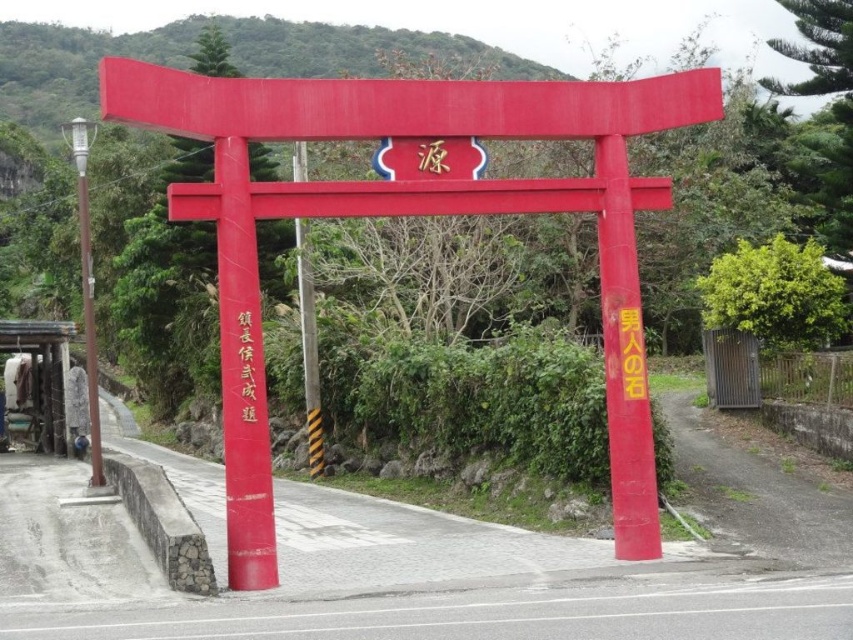
You are standing at the center of the image and want to walk directly towards the matte red torii gate at center. In which direction should you move?

Since the matte red torii gate at center is already at the center of the image, you are already facing it directly. There is no need to move in any direction as you are already aligned with it.

You are standing at point (x=248, y=390) and want to walk towards the torii gate. Is the point (x=318, y=368) behind you or in front of you relative to your current position?

Point (x=318, y=368) is behind point (x=248, y=390), so if you are standing at point (x=248, y=390) facing towards the torii gate, the point (x=318, y=368) would be behind you relative to your current position.